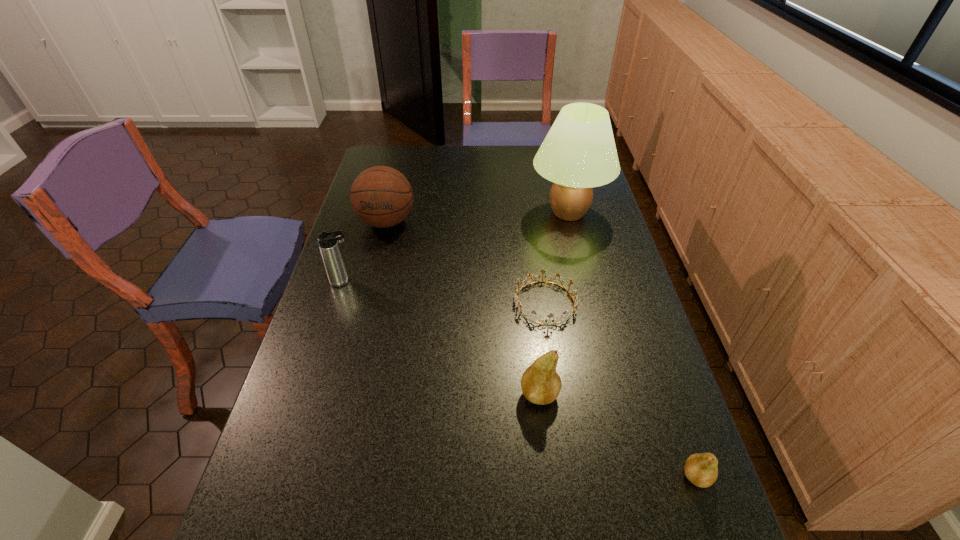
This screenshot has width=960, height=540. In order to click on the left pear in this screenshot , I will do `click(540, 383)`.

Identify the location of the taller pear. Image resolution: width=960 pixels, height=540 pixels. (540, 383).

Identify the location of the second shortest object. The width and height of the screenshot is (960, 540). (701, 469).

Where is `the nearest object`? The image size is (960, 540). the nearest object is located at coordinates (701, 469).

The image size is (960, 540). I want to click on lampshade, so click(579, 152).

The image size is (960, 540). Find the location of `basketball`. basketball is located at coordinates pyautogui.click(x=381, y=196).

The image size is (960, 540). Identify the location of the shortest object. (518, 304).

The width and height of the screenshot is (960, 540). Identify the location of thermos bottle. (328, 241).

Find the location of a particular element. The width and height of the screenshot is (960, 540). blank space located on the back of the second nearest object is located at coordinates (528, 288).

Identify the location of vacant space located 0.060m on the left of the shorter pear. (653, 476).